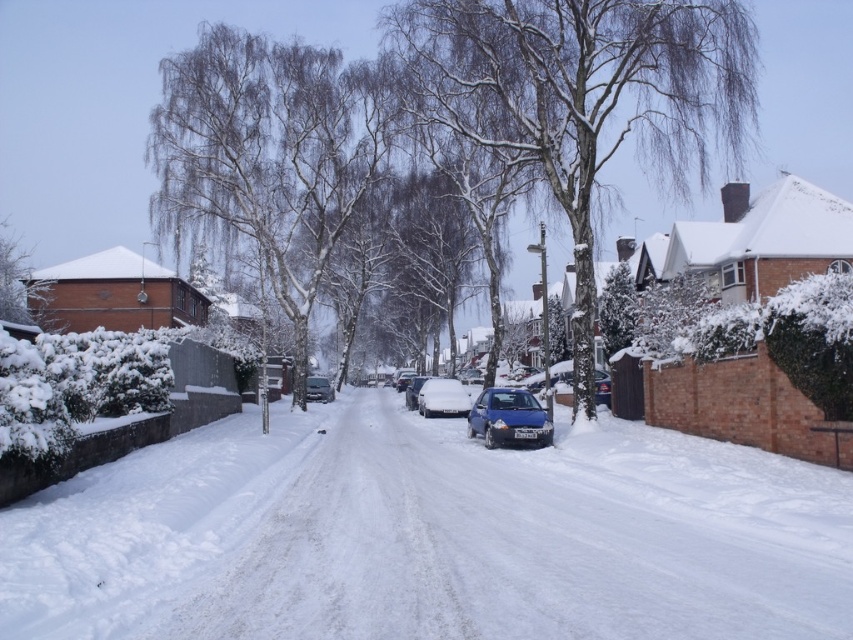
This screenshot has width=853, height=640. What do you see at coordinates (581, 97) in the screenshot? I see `snow-covered bark tree at center` at bounding box center [581, 97].

Which is in front, point (544, 157) or point (51, 321)?

Point (544, 157) is more forward.

Find the location of a particular element. snow-covered bark tree at center is located at coordinates (581, 97).

Describe the element at coordinates (509, 419) in the screenshot. The width and height of the screenshot is (853, 640). I see `metallic blue hatchback at center` at that location.

Locate an element on the screen. The width and height of the screenshot is (853, 640). metallic blue hatchback at center is located at coordinates (509, 419).

Is snow-covered bark tree at center thinner than blue metallic car at center?

Incorrect, snow-covered bark tree at center's width is not less than blue metallic car at center's.

The image size is (853, 640). Identify the location of snow-covered bark tree at center. (581, 97).